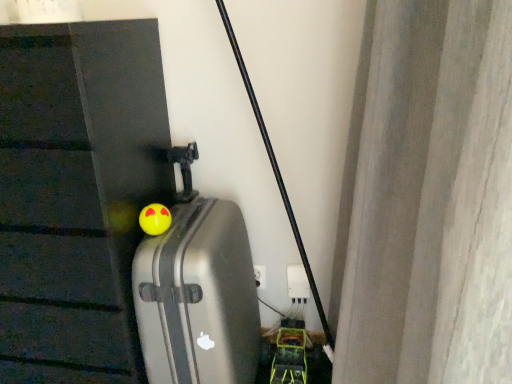
The width and height of the screenshot is (512, 384). I want to click on silver metallic suitcase at center, so click(x=197, y=291).

Describe the element at coordinates (197, 291) in the screenshot. The image size is (512, 384). I see `silver metallic suitcase at center` at that location.

Identify the location of yellow rubber ball at center. The width and height of the screenshot is (512, 384). (155, 219).

Describe the element at coordinates (155, 219) in the screenshot. This screenshot has width=512, height=384. I see `yellow rubber ball at center` at that location.

You are a GUI agent. You are given a task and a screenshot of the screen. Output one action in this format:
    pyautogui.click(x=<x>, y=<y>)
    Task: Click on the silver metallic suitcase at center
    The height and width of the screenshot is (384, 512).
    Given the screenshot: What is the action you would take?
    pyautogui.click(x=197, y=291)

Visually, is yellow rubber ball at center positioned to the left or to the right of silver metallic suitcase at center?

From the image, it's evident that yellow rubber ball at center is to the left of silver metallic suitcase at center.

Is yellow rubber ball at center in front of silver metallic suitcase at center?

No, the depth of yellow rubber ball at center is greater than that of silver metallic suitcase at center.

Considering the positions of point (158, 210) and point (149, 380), is point (158, 210) closer or farther from the camera than point (149, 380)?

Point (158, 210) is positioned closer to the camera compared to point (149, 380).

From the picture: From the image's perspective, who appears lower, yellow rubber ball at center or silver metallic suitcase at center?

silver metallic suitcase at center appears lower in the image.

From a real-world perspective, is yellow rubber ball at center above or below silver metallic suitcase at center?

In terms of real-world spatial position, yellow rubber ball at center is above silver metallic suitcase at center.

In the scene shown: Considering the relative sizes of yellow rubber ball at center and silver metallic suitcase at center in the image provided, is yellow rubber ball at center thinner than silver metallic suitcase at center?

Yes.

From their relative heights in the image, would you say yellow rubber ball at center is taller or shorter than silver metallic suitcase at center?

Considering their sizes, yellow rubber ball at center has less height than silver metallic suitcase at center.

Considering the sizes of yellow rubber ball at center and silver metallic suitcase at center in the image, is yellow rubber ball at center bigger or smaller than silver metallic suitcase at center?

In the image, yellow rubber ball at center appears to be smaller than silver metallic suitcase at center.

Does yellow rubber ball at center contain silver metallic suitcase at center?

No.

Based on the photo, can you see yellow rubber ball at center touching silver metallic suitcase at center?

They are not placed beside each other.

Is yellow rubber ball at center facing towards silver metallic suitcase at center?

Yes, yellow rubber ball at center faces towards silver metallic suitcase at center.

Locate an element on the screen. This screenshot has height=384, width=512. suitcase in front of the yellow rubber ball at center is located at coordinates (197, 291).

Is silver metallic suitcase at center at the left side of yellow rubber ball at center?

No, silver metallic suitcase at center is not to the left of yellow rubber ball at center.

In the image, is silver metallic suitcase at center positioned in front of or behind yellow rubber ball at center?

Clearly, silver metallic suitcase at center is in front of yellow rubber ball at center.

Which is nearer, (x=221, y=318) or (x=150, y=232)?

The point (x=221, y=318) is closer.

From the image's perspective, is silver metallic suitcase at center on top of yellow rubber ball at center?

No, from the image's perspective, silver metallic suitcase at center is not on top of yellow rubber ball at center.

From a real-world perspective, which is physically below, silver metallic suitcase at center or yellow rubber ball at center?

silver metallic suitcase at center.

Between silver metallic suitcase at center and yellow rubber ball at center, which one has smaller width?

yellow rubber ball at center.

Is silver metallic suitcase at center taller than yellow rubber ball at center?

Yes, silver metallic suitcase at center is taller than yellow rubber ball at center.

Which of these two, silver metallic suitcase at center or yellow rubber ball at center, is bigger?

silver metallic suitcase at center is bigger.

Would you say silver metallic suitcase at center is outside yellow rubber ball at center?

Yes, silver metallic suitcase at center is outside of yellow rubber ball at center.

In the scene shown: Does silver metallic suitcase at center touch yellow rubber ball at center?

silver metallic suitcase at center and yellow rubber ball at center are clearly separated.

Is silver metallic suitcase at center oriented away from yellow rubber ball at center?

silver metallic suitcase at center does not have its back to yellow rubber ball at center.

Measure the distance between silver metallic suitcase at center and yellow rubber ball at center.

silver metallic suitcase at center and yellow rubber ball at center are 9.60 inches apart from each other.

Where is `suitcase that is in front of the yellow rubber ball at center`? The width and height of the screenshot is (512, 384). suitcase that is in front of the yellow rubber ball at center is located at coordinates (197, 291).

Image resolution: width=512 pixels, height=384 pixels. I want to click on toy lying behind the silver metallic suitcase at center, so click(155, 219).

You are a GUI agent. You are given a task and a screenshot of the screen. Output one action in this format:
    pyautogui.click(x=<x>, y=<y>)
    Task: Click on the suitcase to the right of yellow rubber ball at center
    
    Given the screenshot: What is the action you would take?
    pyautogui.click(x=197, y=291)